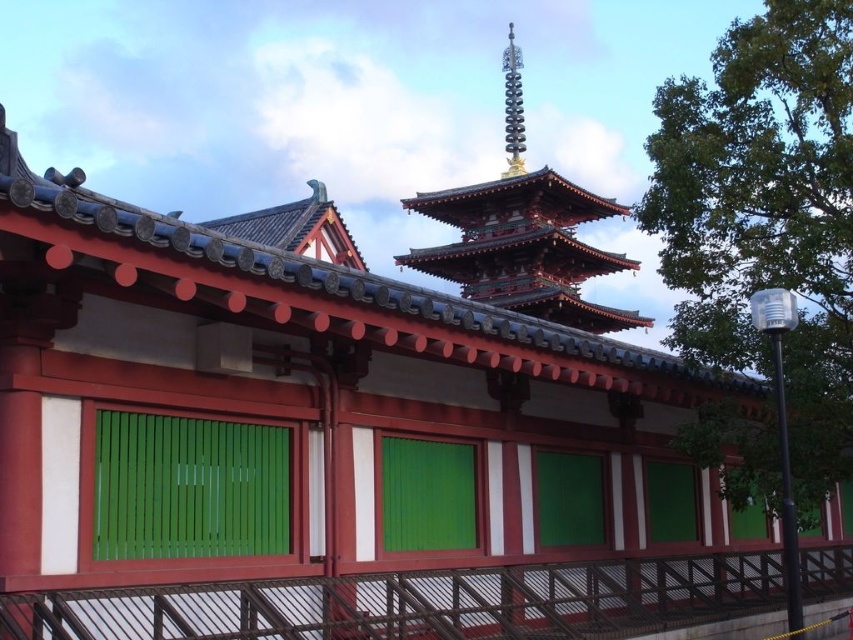
Does shiny gold pagoda at upper center have a smaller size compared to metallic spire at upper center?

Actually, shiny gold pagoda at upper center might be larger than metallic spire at upper center.

This screenshot has width=853, height=640. What are the coordinates of `shiny gold pagoda at upper center` in the screenshot? It's located at (523, 234).

Is point (554, 310) more distant than point (515, 100)?

No.

Find the location of a particular element. shiny gold pagoda at upper center is located at coordinates (523, 234).

Does green wooden slats at center appear under green wooden shutter at center?

Actually, green wooden slats at center is above green wooden shutter at center.

The height and width of the screenshot is (640, 853). In order to click on green wooden slats at center in this screenshot , I will do `click(189, 486)`.

Is green wooden slats at center to the right of metallic spire at upper center from the viewer's perspective?

Incorrect, green wooden slats at center is not on the right side of metallic spire at upper center.

Is point (107, 426) closer to viewer compared to point (515, 93)?

Yes, point (107, 426) is in front of point (515, 93).

You are a GUI agent. You are given a task and a screenshot of the screen. Output one action in this format:
    pyautogui.click(x=<x>, y=<y>)
    Task: Click on the green wooden slats at center
    This screenshot has height=640, width=853.
    Given the screenshot: What is the action you would take?
    pyautogui.click(x=189, y=486)